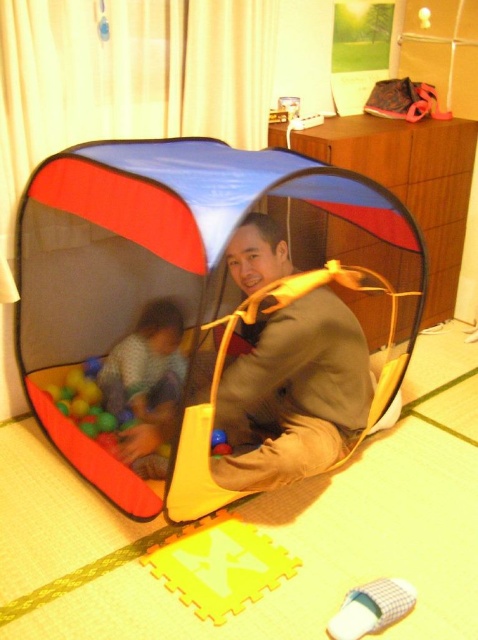
You are a parent trying to fit both the brown suede jacket at center and the patterned fabric child at center into a rectangular storage box. Based on their sizes, which item should you place first to ensure both fit inside?

The brown suede jacket at center is wider than the patterned fabric child at center. To fit both into the storage box, place the larger item first, so put the brown suede jacket at center first, then the patterned fabric child at center.

You are a parent trying to locate your child inside the play tent. You see the brown suede jacket at center and the patterned fabric child at center. Which object is nearer to you?

The brown suede jacket at center is closer to the viewer than the patterned fabric child at center.